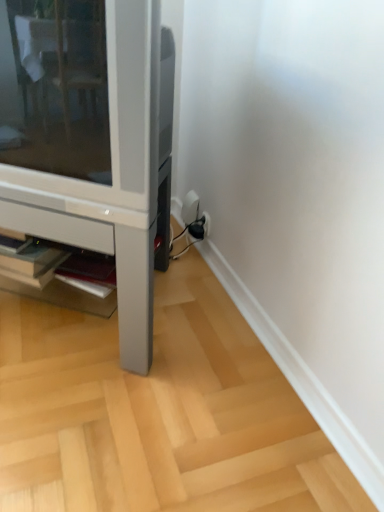
The width and height of the screenshot is (384, 512). I want to click on satin silver tv stand at lower left, so click(x=91, y=141).

The image size is (384, 512). What do you see at coordinates (91, 141) in the screenshot?
I see `satin silver tv stand at lower left` at bounding box center [91, 141].

What is the approximate height of matte white shelf at lower center?

It is 10.99 centimeters.

The height and width of the screenshot is (512, 384). Describe the element at coordinates (58, 276) in the screenshot. I see `matte white shelf at lower center` at that location.

Find the location of `matte white shelf at lower center`. matte white shelf at lower center is located at coordinates (58, 276).

The height and width of the screenshot is (512, 384). What are the coordinates of `satin silver tv stand at lower left` in the screenshot? It's located at (91, 141).

Which object is positioned more to the left, matte white shelf at lower center or satin silver tv stand at lower left?

satin silver tv stand at lower left is more to the left.

Is the depth of matte white shelf at lower center greater than that of satin silver tv stand at lower left?

Yes.

Which point is more distant from viewer, (x=88, y=269) or (x=32, y=57)?

The point (x=88, y=269) is more distant.

From the image's perspective, between matte white shelf at lower center and satin silver tv stand at lower left, who is located below?

From the image's view, matte white shelf at lower center is below.

Consider the image. From a real-world perspective, is matte white shelf at lower center below satin silver tv stand at lower left?

Correct, in the physical world, matte white shelf at lower center is lower than satin silver tv stand at lower left.

Does matte white shelf at lower center have a lesser width compared to satin silver tv stand at lower left?

Yes.

Is matte white shelf at lower center taller or shorter than satin silver tv stand at lower left?

Clearly, matte white shelf at lower center is shorter compared to satin silver tv stand at lower left.

Which of these two, matte white shelf at lower center or satin silver tv stand at lower left, is smaller?

matte white shelf at lower center.

Is matte white shelf at lower center not within satin silver tv stand at lower left?

No, matte white shelf at lower center is inside or overlapping with satin silver tv stand at lower left.

Are matte white shelf at lower center and satin silver tv stand at lower left far apart?

No, matte white shelf at lower center is not far from satin silver tv stand at lower left.

Is matte white shelf at lower center aimed at satin silver tv stand at lower left?

Yes.

Consider the image. What's the angular difference between matte white shelf at lower center and satin silver tv stand at lower left's facing directions?

matte white shelf at lower center and satin silver tv stand at lower left are facing 5.8 degrees away from each other.

Where is `furniture above the matte white shelf at lower center (from the image's perspective)`? furniture above the matte white shelf at lower center (from the image's perspective) is located at coordinates (91, 141).

Does satin silver tv stand at lower left appear on the right side of matte white shelf at lower center?

No.

Who is more distant, satin silver tv stand at lower left or matte white shelf at lower center?

matte white shelf at lower center is behind.

Does point (137, 155) appear closer or farther from the camera than point (11, 244)?

Point (137, 155) is positioned closer to the camera compared to point (11, 244).

From the image's perspective, which one is positioned lower, satin silver tv stand at lower left or matte white shelf at lower center?

matte white shelf at lower center appears lower in the image.

From a real-world perspective, between satin silver tv stand at lower left and matte white shelf at lower center, who is vertically lower?

matte white shelf at lower center, from a real-world perspective.

Which of these two, satin silver tv stand at lower left or matte white shelf at lower center, is thinner?

matte white shelf at lower center.

Which of these two, satin silver tv stand at lower left or matte white shelf at lower center, stands taller?

satin silver tv stand at lower left is taller.

Can you confirm if satin silver tv stand at lower left is bigger than matte white shelf at lower center?

Correct, satin silver tv stand at lower left is larger in size than matte white shelf at lower center.

Can we say satin silver tv stand at lower left lies outside matte white shelf at lower center?

satin silver tv stand at lower left is positioned outside matte white shelf at lower center.

From the picture: Would you consider satin silver tv stand at lower left to be distant from matte white shelf at lower center?

satin silver tv stand at lower left is actually quite close to matte white shelf at lower center.

Is satin silver tv stand at lower left looking in the opposite direction of matte white shelf at lower center?

Yes, satin silver tv stand at lower left's orientation is away from matte white shelf at lower center.

How different are the orientations of satin silver tv stand at lower left and matte white shelf at lower center in degrees?

They differ by 5.8 degrees in their facing directions.

Identify the location of shelf below the satin silver tv stand at lower left (from a real-world perspective). This screenshot has width=384, height=512. (58, 276).

Identify the location of furniture above the matte white shelf at lower center (from the image's perspective). (91, 141).

Locate an element on the screen. The width and height of the screenshot is (384, 512). furniture above the matte white shelf at lower center (from a real-world perspective) is located at coordinates (91, 141).